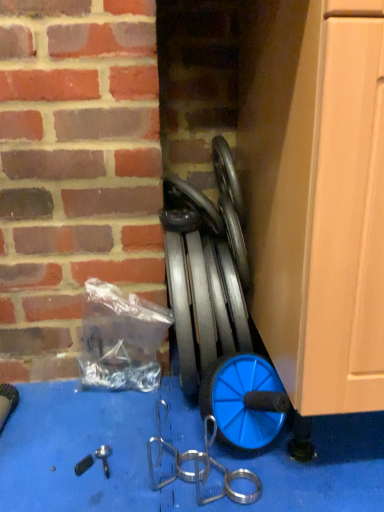
Question: Would you say blue rubber hose at center is outside transparent plastic bag at center-left?

Choices:
 (A) no
 (B) yes

Answer: (B)

Question: Considering the relative sizes of blue rubber hose at center and transparent plastic bag at center-left in the image provided, is blue rubber hose at center wider than transparent plastic bag at center-left?

Choices:
 (A) no
 (B) yes

Answer: (B)

Question: Does blue rubber hose at center lie behind transparent plastic bag at center-left?

Choices:
 (A) no
 (B) yes

Answer: (A)

Question: Is blue rubber hose at center facing away from transparent plastic bag at center-left?

Choices:
 (A) no
 (B) yes

Answer: (A)

Question: Is blue rubber hose at center to the right of transparent plastic bag at center-left from the viewer's perspective?

Choices:
 (A) yes
 (B) no

Answer: (A)

Question: Is blue rubber wheel at center bigger or smaller than blue rubber hose at center?

Choices:
 (A) big
 (B) small

Answer: (B)

Question: In terms of width, does blue rubber wheel at center look wider or thinner when compared to blue rubber hose at center?

Choices:
 (A) thin
 (B) wide

Answer: (A)

Question: Is point (203, 202) closer or farther from the camera than point (178, 329)?

Choices:
 (A) farther
 (B) closer

Answer: (A)

Question: From a real-world perspective, is blue rubber wheel at center physically located above or below blue rubber hose at center?

Choices:
 (A) below
 (B) above

Answer: (B)

Question: Relative to blue rubber wheel at center, is transparent plastic bag at center-left in front or behind?

Choices:
 (A) behind
 (B) front

Answer: (A)

Question: Considering the positions of transparent plastic bag at center-left and blue rubber wheel at center in the image, is transparent plastic bag at center-left bigger or smaller than blue rubber wheel at center?

Choices:
 (A) big
 (B) small

Answer: (A)

Question: Visually, is transparent plastic bag at center-left positioned to the left or to the right of blue rubber wheel at center?

Choices:
 (A) right
 (B) left

Answer: (B)

Question: From a real-world perspective, is transparent plastic bag at center-left physically located above or below blue rubber wheel at center?

Choices:
 (A) above
 (B) below

Answer: (B)

Question: Visually, is blue rubber hose at center positioned to the left or to the right of blue rubber wheel at center?

Choices:
 (A) left
 (B) right

Answer: (B)

Question: In terms of width, does blue rubber hose at center look wider or thinner when compared to blue rubber wheel at center?

Choices:
 (A) wide
 (B) thin

Answer: (A)